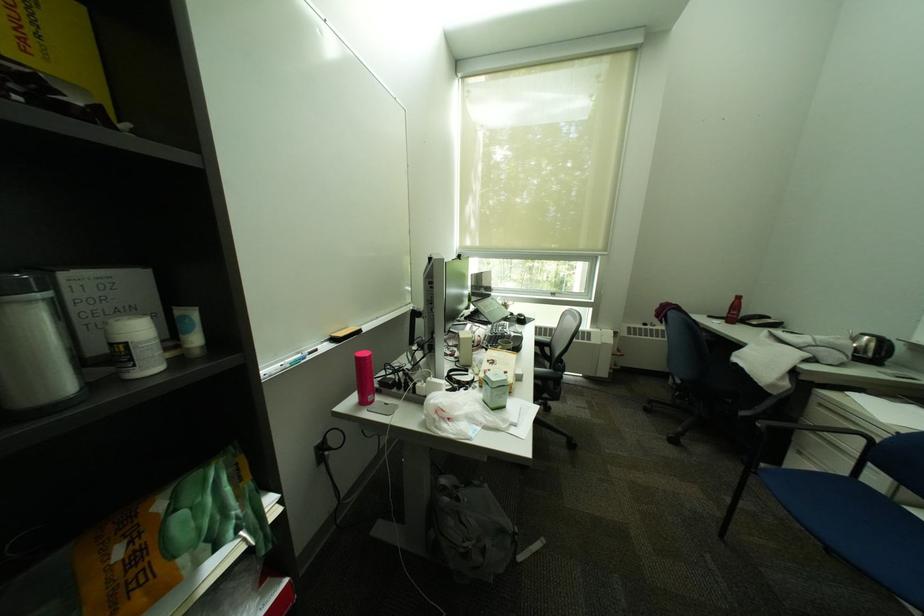
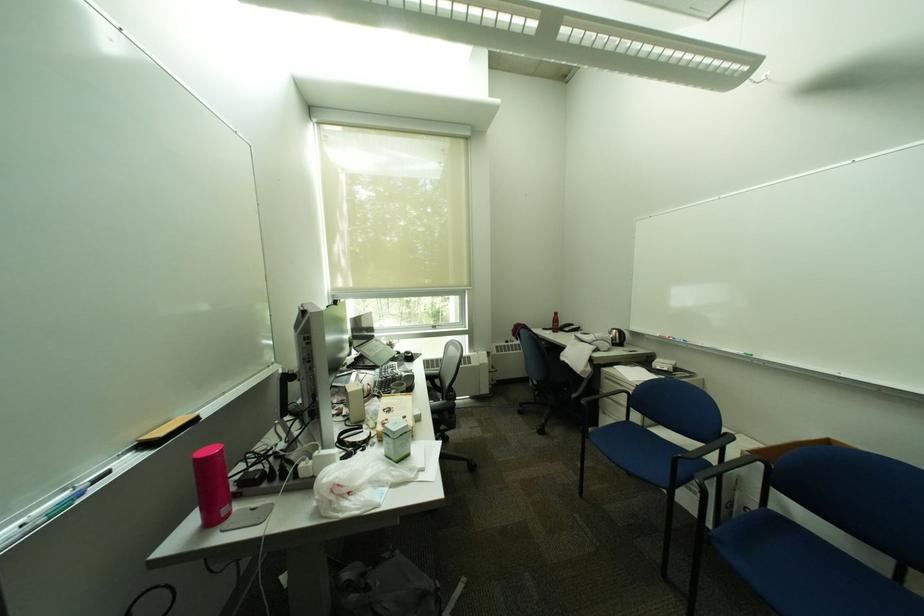
In the second image, find the point that corresponds to (x=766, y=475) in the first image.

(599, 439)